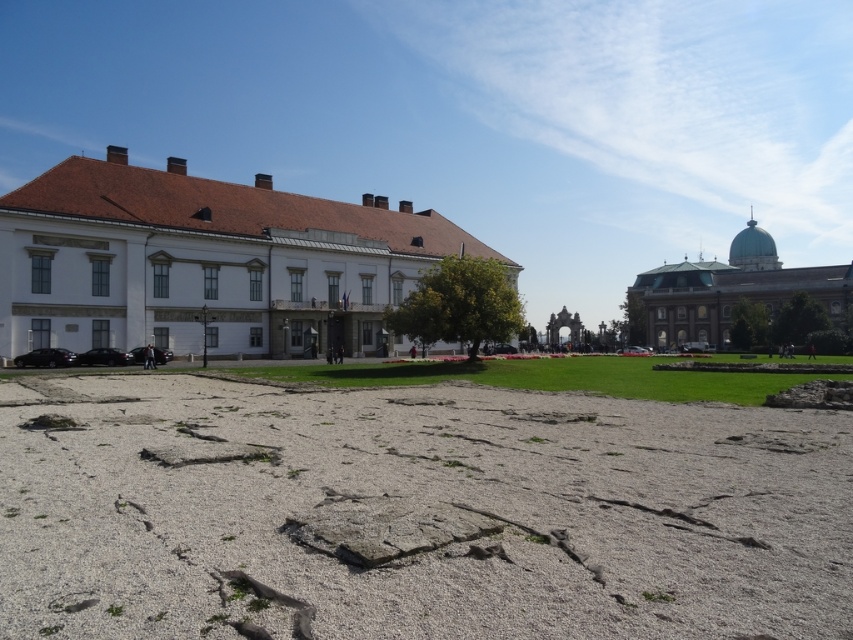
Question: Considering the real-world distances, which object is closest to the green dome building at upper right?

Choices:
 (A) matte stone arch at center
 (B) white smooth building at center

Answer: (A)

Question: In this image, where is white smooth building at center located relative to green dome building at upper right?

Choices:
 (A) below
 (B) above

Answer: (B)

Question: Which object is the closest to the matte stone arch at center?

Choices:
 (A) green dome building at upper right
 (B) white smooth building at center

Answer: (A)

Question: Is white smooth building at center to the left of green dome building at upper right from the viewer's perspective?

Choices:
 (A) yes
 (B) no

Answer: (A)

Question: In this image, where is white smooth building at center located relative to green dome building at upper right?

Choices:
 (A) below
 (B) above

Answer: (B)

Question: Which is farther from the white smooth building at center?

Choices:
 (A) matte stone arch at center
 (B) green dome building at upper right

Answer: (B)